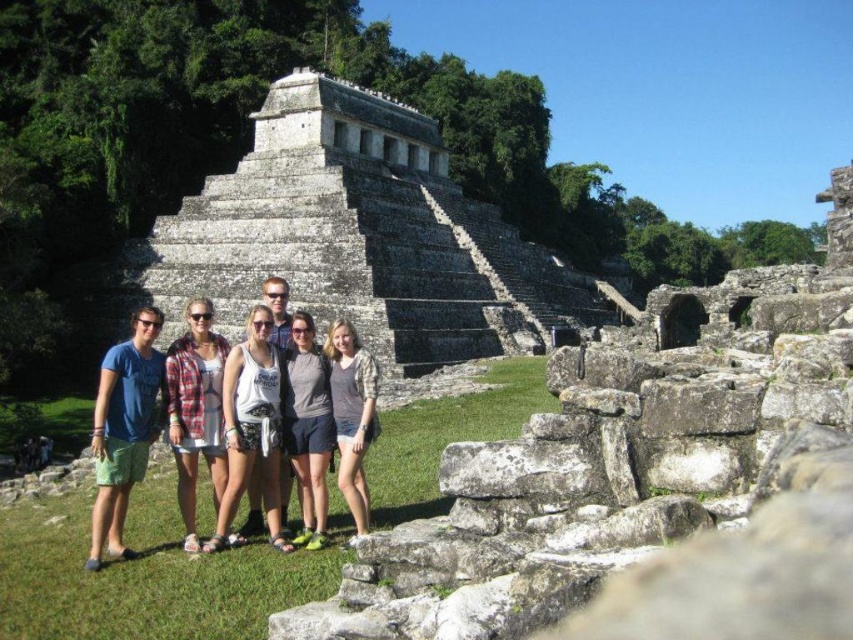
Can you confirm if matte blue t-shirt at center is shorter than gray fabric shorts at center?

In fact, matte blue t-shirt at center may be taller than gray fabric shorts at center.

Image resolution: width=853 pixels, height=640 pixels. Describe the element at coordinates (123, 429) in the screenshot. I see `matte blue t-shirt at center` at that location.

Image resolution: width=853 pixels, height=640 pixels. I want to click on matte blue t-shirt at center, so click(123, 429).

Which is in front, point (111, 506) or point (219, 396)?

Positioned in front is point (111, 506).

Is point (96, 449) positioned after point (219, 396)?

No.

Does point (97, 513) come behind point (221, 404)?

No, it is in front of (221, 404).

Locate an element on the screen. matte blue t-shirt at center is located at coordinates (123, 429).

Which is behind, point (198, 349) or point (332, 445)?

The point (198, 349) is more distant.

Does plaid fabric shirt at center appear over gray fabric shorts at center?

Correct, plaid fabric shirt at center is located above gray fabric shorts at center.

What do you see at coordinates (196, 410) in the screenshot?
I see `plaid fabric shirt at center` at bounding box center [196, 410].

Locate an element on the screen. The image size is (853, 640). plaid fabric shirt at center is located at coordinates (196, 410).